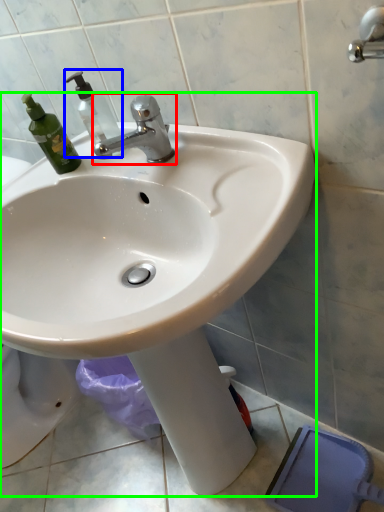
Question: Based on their relative distances, which object is farther from tap (highlighted by a red box)? Choose from soap dispenser (highlighted by a blue box) and sink (highlighted by a green box).

Choices:
 (A) soap dispenser
 (B) sink

Answer: (B)